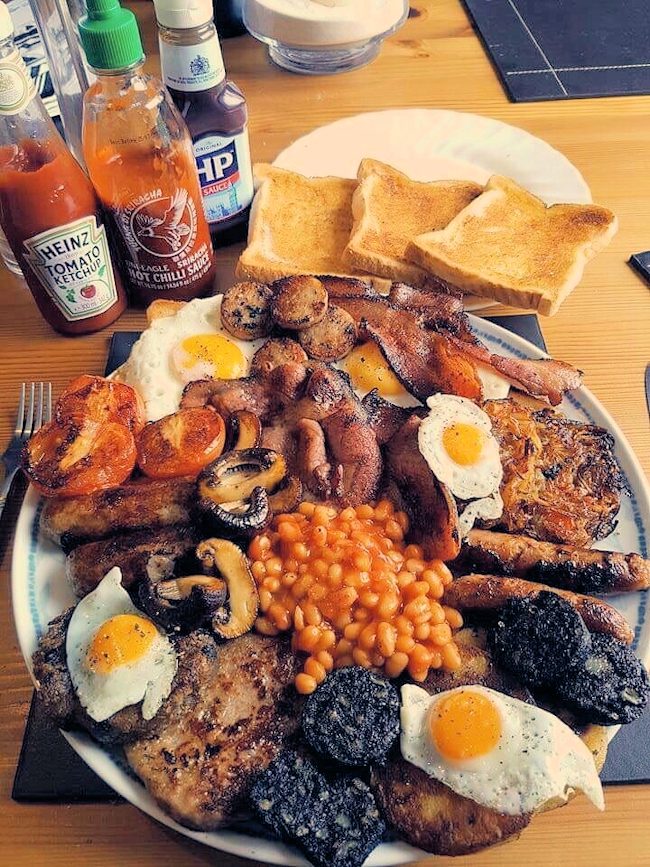
This screenshot has height=867, width=650. In order to click on placemat corners in this screenshot , I will do `click(513, 320)`, `click(125, 336)`, `click(643, 255)`, `click(47, 784)`, `click(512, 85)`.